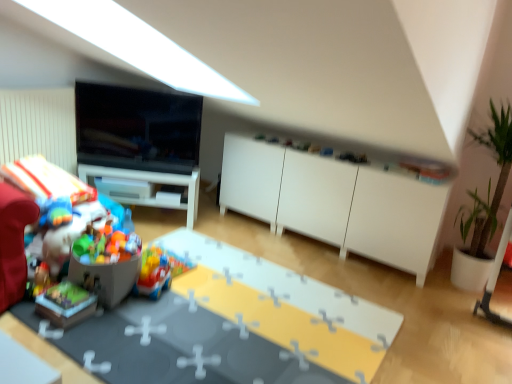
You are a GUI agent. You are given a task and a screenshot of the screen. Output one action in this format:
    pyautogui.click(x=<x>, y=<y>)
    Task: Click on the vacant space to the right of wooden block at lower left, the 3th toy positioned from the right
    This screenshot has width=512, height=384.
    Given the screenshot: What is the action you would take?
    pyautogui.click(x=116, y=313)